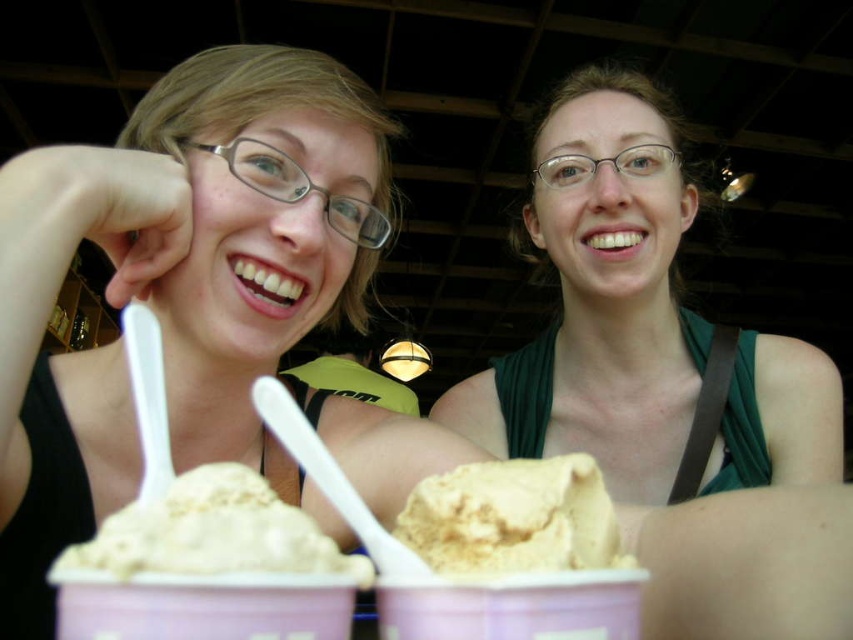
Question: Is green matte tank top at center further to camera compared to vanilla ice cream at center?

Choices:
 (A) yes
 (B) no

Answer: (A)

Question: Which point is farther from the camera taking this photo?

Choices:
 (A) (750, 468)
 (B) (212, 528)

Answer: (A)

Question: Does green matte tank top at center appear on the right side of vanilla ice cream at center?

Choices:
 (A) no
 (B) yes

Answer: (B)

Question: Among these objects, which one is farthest from the camera?

Choices:
 (A) green matte tank top at center
 (B) vanilla ice cream at lower center
 (C) matte plastic spoon at upper center

Answer: (A)

Question: Estimate the real-world distances between objects in this image. Which object is farther from the matte plastic spoon at upper center?

Choices:
 (A) green matte tank top at center
 (B) vanilla ice cream at lower center

Answer: (A)

Question: Is green matte tank top at center positioned at the back of vanilla ice cream at center?

Choices:
 (A) no
 (B) yes

Answer: (B)